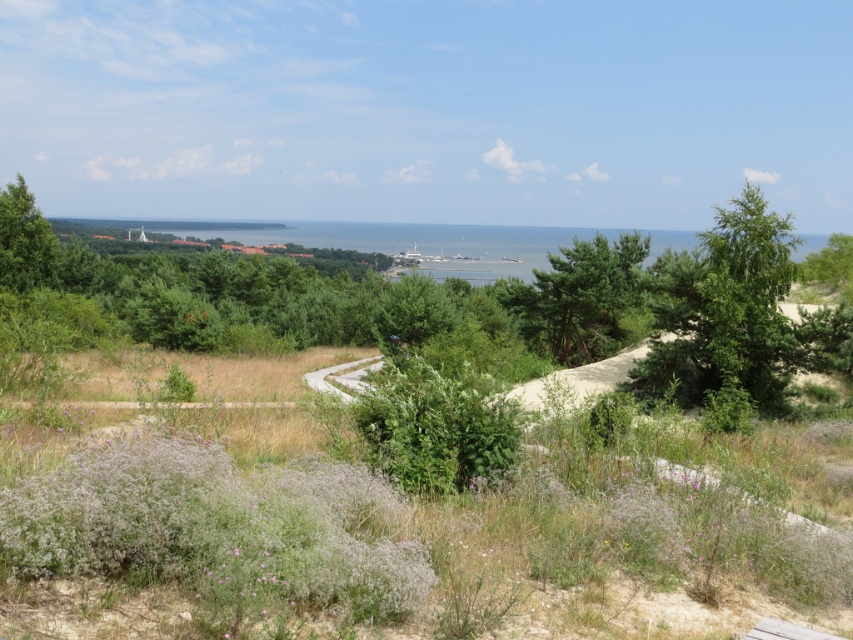
Question: Is green leafy tree at right smaller than green textured pine tree at center?

Choices:
 (A) no
 (B) yes

Answer: (A)

Question: Can you confirm if green leafy tree at right is positioned to the left of green textured pine tree at center?

Choices:
 (A) no
 (B) yes

Answer: (A)

Question: Considering the relative positions of green textured pine tree at center and green leafy tree at upper left in the image provided, where is green textured pine tree at center located with respect to green leafy tree at upper left?

Choices:
 (A) right
 (B) left

Answer: (A)

Question: Which point is farther to the camera?

Choices:
 (A) green leafy tree at upper left
 (B) green textured pine tree at center
 (C) green leafy tree at right

Answer: (A)

Question: Which object appears closest to the camera in this image?

Choices:
 (A) green leafy tree at right
 (B) green textured pine tree at center
 (C) green leafy tree at upper left

Answer: (A)

Question: Which object is positioned closest to the green leafy tree at upper left?

Choices:
 (A) green textured pine tree at center
 (B) green leafy tree at right

Answer: (A)